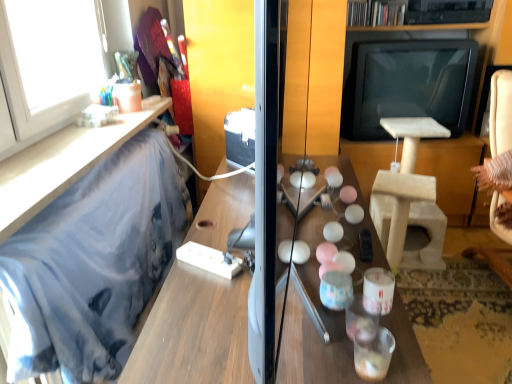
You are a GUI agent. You are given a task and a screenshot of the screen. Output one action in this format:
    pyautogui.click(x=<x>, y=<y>)
    Task: Click on the blue fabric at left, the first furniture from the top
    The height and width of the screenshot is (384, 512).
    Given the screenshot: What is the action you would take?
    pyautogui.click(x=62, y=163)

What do you see at coordinates (498, 154) in the screenshot?
I see `beige fabric swivel chair at right` at bounding box center [498, 154].

I want to click on beige fabric swivel chair at right, so click(x=498, y=154).

Describe the element at coordinates (49, 63) in the screenshot. I see `white glossy window at upper left` at that location.

This screenshot has width=512, height=384. What do you see at coordinates (63, 163) in the screenshot?
I see `blue fabric at left, the first furniture when ordered from bottom to top` at bounding box center [63, 163].

What is the approximate width of wooden table at center?

wooden table at center is 24.16 inches in width.

The image size is (512, 384). Identify the location of blue fabric at left, the second furniture in the bottom-to-top sequence. (62, 163).

Considering the relative sizes of blue fabric at left, the first furniture when ordered from bottom to top, and white glossy window at upper left in the image provided, is blue fabric at left, the first furniture when ordered from bottom to top, smaller than white glossy window at upper left?

No, blue fabric at left, the first furniture when ordered from bottom to top, is not smaller than white glossy window at upper left.

Which is less distant, [39,173] or [84,42]?

The point [39,173] is in front.

Does blue fabric at left, positioned as the 2th furniture in top-to-bottom order, contain white glossy window at upper left?

Actually, white glossy window at upper left is outside blue fabric at left, positioned as the 2th furniture in top-to-bottom order.

From a real-world perspective, is wooden table at center physically located above or below white glossy window at upper left?

wooden table at center is below white glossy window at upper left.

Between wooden table at center and white glossy window at upper left, which one appears on the right side from the viewer's perspective?

Positioned to the right is wooden table at center.

Who is more distant, wooden table at center or white glossy window at upper left?

white glossy window at upper left is behind.

In terms of width, does wooden table at center look wider or thinner when compared to white glossy window at upper left?

wooden table at center is wider than white glossy window at upper left.

Is wooden table at center aimed at white glossy candle holder at center?

No, wooden table at center is not facing towards white glossy candle holder at center.

How many degrees apart are the facing directions of wooden table at center and white glossy candle holder at center?

The angular difference between wooden table at center and white glossy candle holder at center is 1.71 degrees.

Based on the photo, is wooden table at center not near white glossy candle holder at center?

No, wooden table at center is in close proximity to white glossy candle holder at center.

Which point is more distant from viewer, (227, 187) or (369, 289)?

The point (227, 187) is farther.

Measure the distance from white glossy candle holder at center to beige fabric swivel chair at right.

white glossy candle holder at center and beige fabric swivel chair at right are 4.39 feet apart from each other.

Is the position of white glossy candle holder at center more distant than that of beige fabric swivel chair at right?

That is False.

Between white glossy candle holder at center and beige fabric swivel chair at right, which one appears on the left side from the viewer's perspective?

white glossy candle holder at center.

Considering the sizes of objects blue fabric at left, the first furniture from the top, and white glossy candle holder at center in the image provided, who is bigger, blue fabric at left, the first furniture from the top, or white glossy candle holder at center?

blue fabric at left, the first furniture from the top.

Based on the photo, is blue fabric at left, the first furniture from the top, oriented towards white glossy candle holder at center?

No, blue fabric at left, the first furniture from the top, is not oriented towards white glossy candle holder at center.

How many degrees apart are the facing directions of blue fabric at left, the first furniture from the top, and white glossy candle holder at center?

The angular difference between blue fabric at left, the first furniture from the top, and white glossy candle holder at center is 0.261 degrees.

Would you say white glossy window at upper left is part of blue fabric at left, the second furniture in the bottom-to-top sequence,'s contents?

Actually, white glossy window at upper left is outside blue fabric at left, the second furniture in the bottom-to-top sequence.

Is blue fabric at left, the first furniture from the top, in front of or behind white glossy window at upper left in the image?

Clearly, blue fabric at left, the first furniture from the top, is in front of white glossy window at upper left.

Considering the sizes of blue fabric at left, the second furniture in the bottom-to-top sequence, and white glossy window at upper left in the image, is blue fabric at left, the second furniture in the bottom-to-top sequence, wider or thinner than white glossy window at upper left?

Clearly, blue fabric at left, the second furniture in the bottom-to-top sequence, has more width compared to white glossy window at upper left.

Between blue fabric at left, the second furniture in the bottom-to-top sequence, and beige fabric swivel chair at right, which one appears on the left side from the viewer's perspective?

From the viewer's perspective, blue fabric at left, the second furniture in the bottom-to-top sequence, appears more on the left side.

From a real-world perspective, relative to beige fabric swivel chair at right, is blue fabric at left, the first furniture from the top, vertically above or below?

blue fabric at left, the first furniture from the top, is above beige fabric swivel chair at right.

From the picture: Is blue fabric at left, the first furniture from the top, next to beige fabric swivel chair at right?

No, blue fabric at left, the first furniture from the top, is not touching beige fabric swivel chair at right.

Considering the sizes of blue fabric at left, the first furniture from the top, and beige fabric swivel chair at right in the image, is blue fabric at left, the first furniture from the top, wider or thinner than beige fabric swivel chair at right?

Clearly, blue fabric at left, the first furniture from the top, has less width compared to beige fabric swivel chair at right.

There is a blue fabric at left, the first furniture when ordered from bottom to top. Identify the location of window above it (from a real-world perspective). The width and height of the screenshot is (512, 384). (49, 63).

At what (x,y) coordinates should I click in order to perform the action: click on table below the white glossy window at upper left (from the image's perspective). Please return your answer as a coordinate pair (x, y). This screenshot has width=512, height=384. Looking at the image, I should click on (194, 331).

From the image, which object appears to be nearer to beige fabric swivel chair at right, wooden table at center or white glossy candle holder at center?

Among the two, wooden table at center is located nearer to beige fabric swivel chair at right.

When comparing their distances from blue fabric at left, the first furniture from the top, does wooden table at center or white glossy candle holder at center seem further?

white glossy candle holder at center is further to blue fabric at left, the first furniture from the top.

From the image, which object appears to be farther from white glossy window at upper left, blue fabric at left, the first furniture from the top, or wooden table at center?

Based on the image, wooden table at center appears to be further to white glossy window at upper left.

From the image, which object appears to be farther from wooden table at center, blue fabric at left, positioned as the 2th furniture in top-to-bottom order, or white glossy window at upper left?

Among the two, white glossy window at upper left is located further to wooden table at center.

Considering their positions, is blue fabric at left, the first furniture when ordered from bottom to top, positioned closer to blue fabric at left, the first furniture from the top, than white glossy candle holder at center?

blue fabric at left, the first furniture when ordered from bottom to top, is closer to blue fabric at left, the first furniture from the top.

Looking at the image, which one is located closer to blue fabric at left, positioned as the 2th furniture in top-to-bottom order, white glossy candle holder at center or white glossy window at upper left?

white glossy window at upper left is closer to blue fabric at left, positioned as the 2th furniture in top-to-bottom order.

Based on the photo, from the image, which object appears to be nearer to blue fabric at left, the first furniture from the top, white glossy candle holder at center or wooden table at center?

wooden table at center is positioned closer to the anchor blue fabric at left, the first furniture from the top.

Considering their positions, is blue fabric at left, the first furniture from the top, positioned further to beige fabric swivel chair at right than white glossy candle holder at center?

The object further to beige fabric swivel chair at right is blue fabric at left, the first furniture from the top.

Where is `candle holder between wooden table at center and beige fabric swivel chair at right from left to right`? This screenshot has width=512, height=384. candle holder between wooden table at center and beige fabric swivel chair at right from left to right is located at coordinates (378, 290).

You are a GUI agent. You are given a task and a screenshot of the screen. Output one action in this format:
    pyautogui.click(x=<x>, y=<y>)
    Task: Click on the table between blue fabric at left, positioned as the 2th furniture in top-to-bottom order, and beige fabric swivel chair at right
    
    Given the screenshot: What is the action you would take?
    pyautogui.click(x=194, y=331)

Locate an element on the screen. furniture between blue fabric at left, the first furniture from the top, and beige fabric swivel chair at right from left to right is located at coordinates (63, 163).

Locate an element on the screen. The height and width of the screenshot is (384, 512). table between white glossy window at upper left and beige fabric swivel chair at right from left to right is located at coordinates (194, 331).